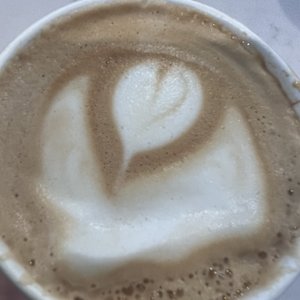
Image resolution: width=300 pixels, height=300 pixels. In order to click on cup in this screenshot , I will do pyautogui.click(x=269, y=292).